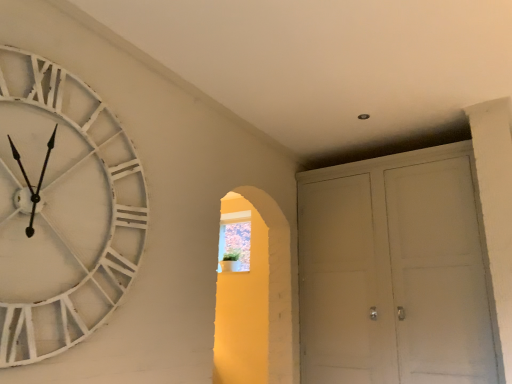
Question: Is white matte cabinet at right at the right side of white distressed wood clock at left?

Choices:
 (A) no
 (B) yes

Answer: (B)

Question: Is white matte cabinet at right smaller than white distressed wood clock at left?

Choices:
 (A) no
 (B) yes

Answer: (A)

Question: From the image's perspective, is white matte cabinet at right below white distressed wood clock at left?

Choices:
 (A) yes
 (B) no

Answer: (A)

Question: Are white matte cabinet at right and white distressed wood clock at left far apart?

Choices:
 (A) no
 (B) yes

Answer: (B)

Question: Is white matte cabinet at right positioned with its back to white distressed wood clock at left?

Choices:
 (A) no
 (B) yes

Answer: (A)

Question: Considering the relative sizes of white matte cabinet at right and white distressed wood clock at left in the image provided, is white matte cabinet at right wider than white distressed wood clock at left?

Choices:
 (A) yes
 (B) no

Answer: (A)

Question: Is white distressed wood clock at left positioned beyond the bounds of translucent glass window at center?

Choices:
 (A) yes
 (B) no

Answer: (A)

Question: Is the surface of white distressed wood clock at left in direct contact with translucent glass window at center?

Choices:
 (A) no
 (B) yes

Answer: (A)

Question: Is white distressed wood clock at left behind translucent glass window at center?

Choices:
 (A) no
 (B) yes

Answer: (A)

Question: From the image's perspective, is white distressed wood clock at left over translucent glass window at center?

Choices:
 (A) no
 (B) yes

Answer: (B)

Question: From the image's perspective, would you say white distressed wood clock at left is shown under translucent glass window at center?

Choices:
 (A) yes
 (B) no

Answer: (B)

Question: Can you confirm if white distressed wood clock at left is thinner than translucent glass window at center?

Choices:
 (A) no
 (B) yes

Answer: (B)

Question: Is translucent glass window at center positioned before white distressed wood clock at left?

Choices:
 (A) yes
 (B) no

Answer: (B)